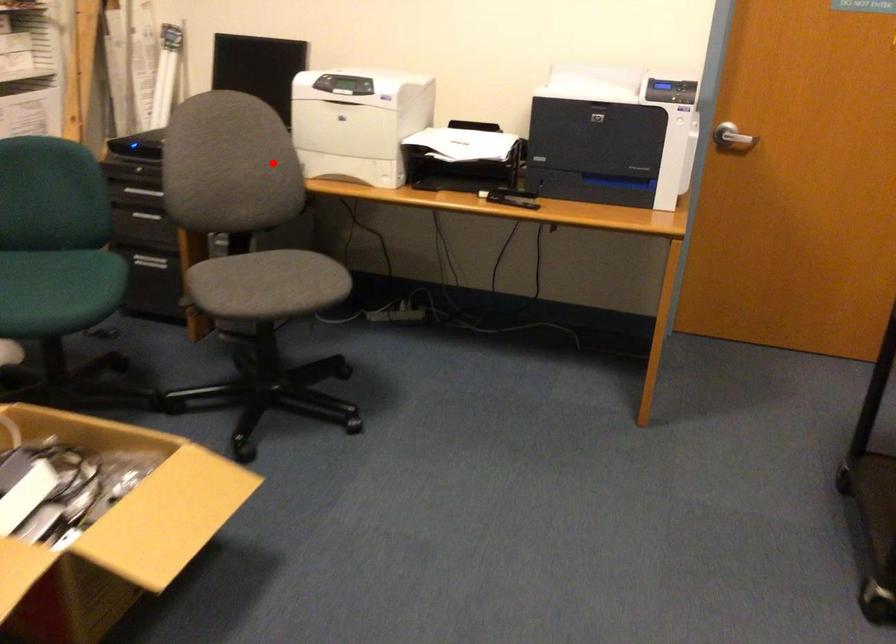
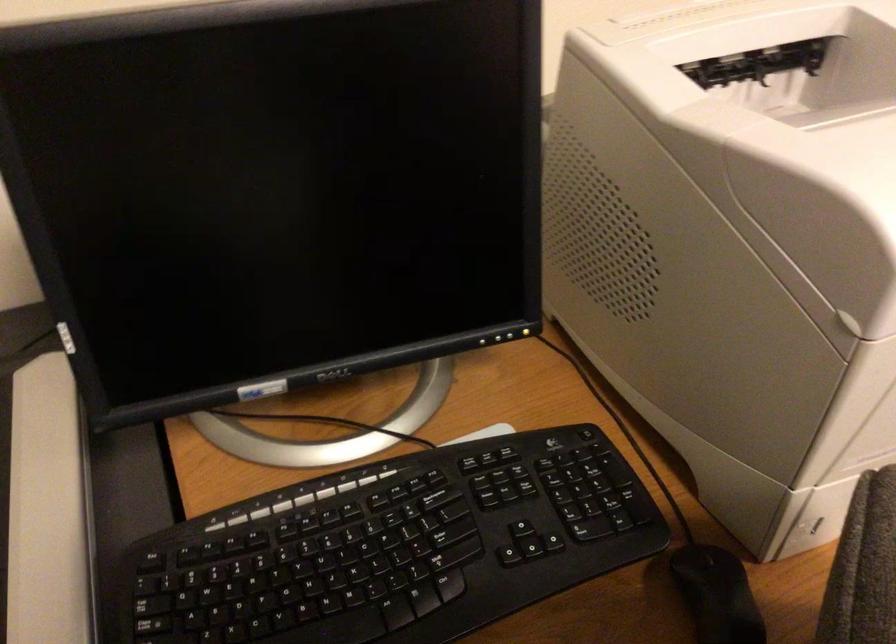
Question: I am providing you with two images of the same scene from different viewpoints. In image1, a red point is highlighted. Considering the same 3D point in image2, which of the following is correct?

Choices:
 (A) It is closer
 (B) It is farther

Answer: (A)